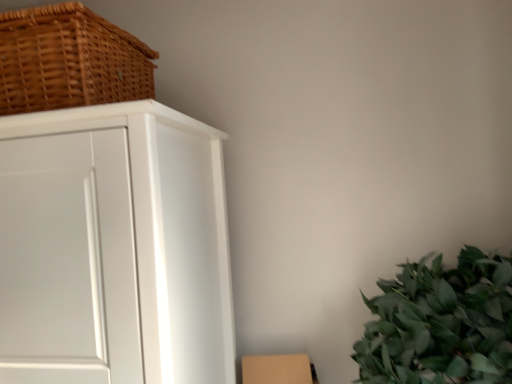
Question: Can you confirm if white matte cabinet at left is smaller than woven brown basket at upper left?

Choices:
 (A) no
 (B) yes

Answer: (A)

Question: From a real-world perspective, is white matte cabinet at left beneath woven brown basket at upper left?

Choices:
 (A) yes
 (B) no

Answer: (A)

Question: From the image's perspective, is white matte cabinet at left below woven brown basket at upper left?

Choices:
 (A) yes
 (B) no

Answer: (A)

Question: Is white matte cabinet at left wider than woven brown basket at upper left?

Choices:
 (A) no
 (B) yes

Answer: (B)

Question: From a real-world perspective, is white matte cabinet at left physically above woven brown basket at upper left?

Choices:
 (A) no
 (B) yes

Answer: (A)

Question: Are white matte cabinet at left and woven brown basket at upper left making contact?

Choices:
 (A) no
 (B) yes

Answer: (A)

Question: Does brown cardboard box at lower right appear on the right side of white matte cabinet at left?

Choices:
 (A) yes
 (B) no

Answer: (A)

Question: Is brown cardboard box at lower right far from white matte cabinet at left?

Choices:
 (A) no
 (B) yes

Answer: (A)

Question: Can you confirm if brown cardboard box at lower right is thinner than white matte cabinet at left?

Choices:
 (A) no
 (B) yes

Answer: (B)

Question: Is white matte cabinet at left a part of brown cardboard box at lower right?

Choices:
 (A) yes
 (B) no

Answer: (B)

Question: From the image's perspective, is brown cardboard box at lower right on white matte cabinet at left?

Choices:
 (A) no
 (B) yes

Answer: (A)

Question: From a real-world perspective, is brown cardboard box at lower right on white matte cabinet at left?

Choices:
 (A) no
 (B) yes

Answer: (A)

Question: Is woven brown basket at upper left oriented away from brown cardboard box at lower right?

Choices:
 (A) yes
 (B) no

Answer: (B)